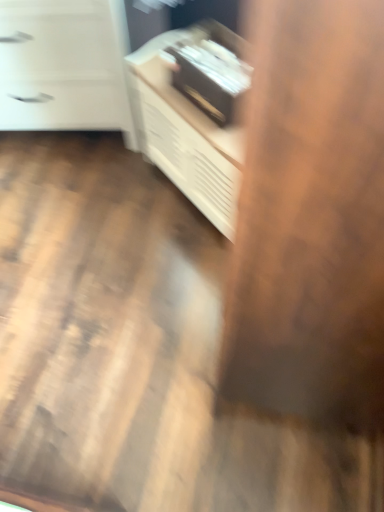
The height and width of the screenshot is (512, 384). In order to click on vacant area that is in front of white wood cabinet at upper center in this screenshot , I will do `click(170, 266)`.